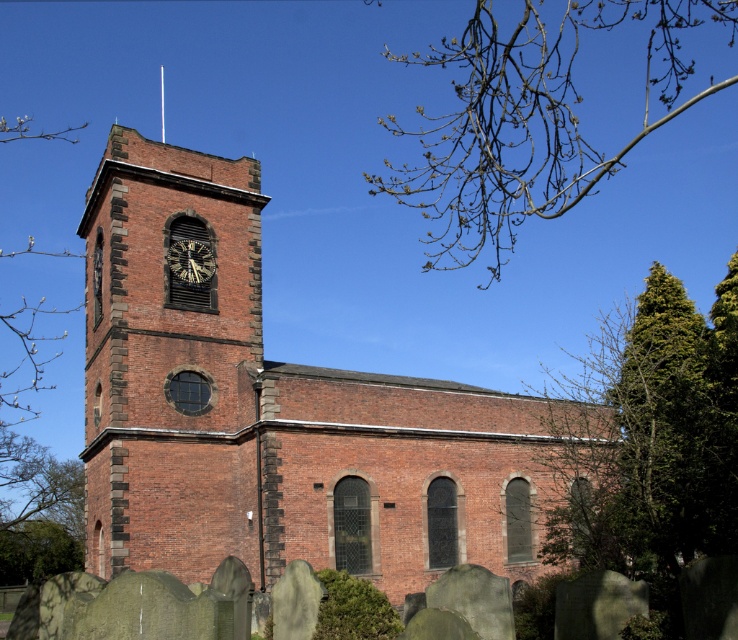
Question: Among these objects, which one is farthest from the camera?

Choices:
 (A) brick church at center
 (B) bare branches at upper right

Answer: (A)

Question: Does brick church at center appear over bare branches at upper left?

Choices:
 (A) yes
 (B) no

Answer: (B)

Question: Which of these objects is positioned closest to the brick church at center?

Choices:
 (A) brown brick clock tower at left
 (B) bare branches at upper right

Answer: (A)

Question: Considering the relative positions of green leafy tree at right and bare branches at upper left in the image provided, where is green leafy tree at right located with respect to bare branches at upper left?

Choices:
 (A) left
 (B) right

Answer: (B)

Question: Is brick church at center further to camera compared to green leafy tree at right?

Choices:
 (A) yes
 (B) no

Answer: (A)

Question: Which is farther from the green leafy tree at right?

Choices:
 (A) bare branches at upper left
 (B) brick church at center
 (C) gold-toned metal clock at upper left

Answer: (A)